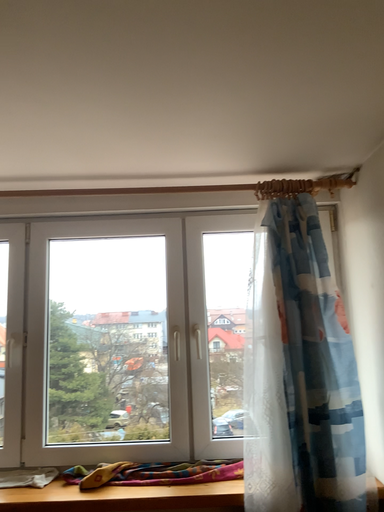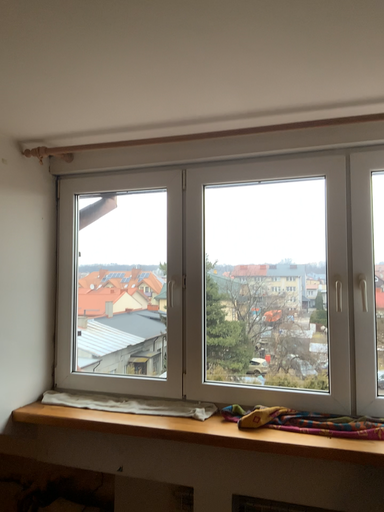
Question: How did the camera likely rotate when shooting the video?

Choices:
 (A) rotated upward
 (B) rotated downward

Answer: (B)